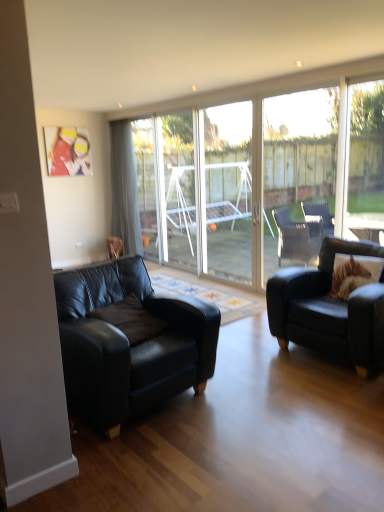
Question: Should I look upward or downward to see transparent glass screen door at center?

Choices:
 (A) down
 (B) up

Answer: (B)

Question: From the image's perspective, does gray fabric curtain at left appear lower than transparent glass door at center?

Choices:
 (A) yes
 (B) no

Answer: (B)

Question: Does gray fabric curtain at left have a greater height compared to transparent glass door at center?

Choices:
 (A) yes
 (B) no

Answer: (A)

Question: Can you confirm if gray fabric curtain at left is positioned to the right of transparent glass door at center?

Choices:
 (A) yes
 (B) no

Answer: (B)

Question: Is gray fabric curtain at left to the left of transparent glass door at center from the viewer's perspective?

Choices:
 (A) yes
 (B) no

Answer: (A)

Question: Would you say gray fabric curtain at left is a long distance from transparent glass door at center?

Choices:
 (A) yes
 (B) no

Answer: (B)

Question: Does gray fabric curtain at left have a greater width compared to transparent glass door at center?

Choices:
 (A) yes
 (B) no

Answer: (A)

Question: Is transparent glass screen door at center not inside brown textured pillow at right?

Choices:
 (A) yes
 (B) no

Answer: (A)

Question: Is brown textured pillow at right at the back of transparent glass screen door at center?

Choices:
 (A) yes
 (B) no

Answer: (B)

Question: Can you confirm if transparent glass screen door at center is smaller than brown textured pillow at right?

Choices:
 (A) no
 (B) yes

Answer: (A)

Question: Is brown textured pillow at right inside transparent glass screen door at center?

Choices:
 (A) yes
 (B) no

Answer: (B)

Question: Does transparent glass screen door at center lie in front of brown textured pillow at right?

Choices:
 (A) yes
 (B) no

Answer: (B)

Question: From the image's perspective, is transparent glass screen door at center beneath brown textured pillow at right?

Choices:
 (A) yes
 (B) no

Answer: (B)

Question: From a real-world perspective, is brown textured pillow at right below black leather couch at left, which is counted as the 1th studio couch, starting from the left?

Choices:
 (A) yes
 (B) no

Answer: (B)